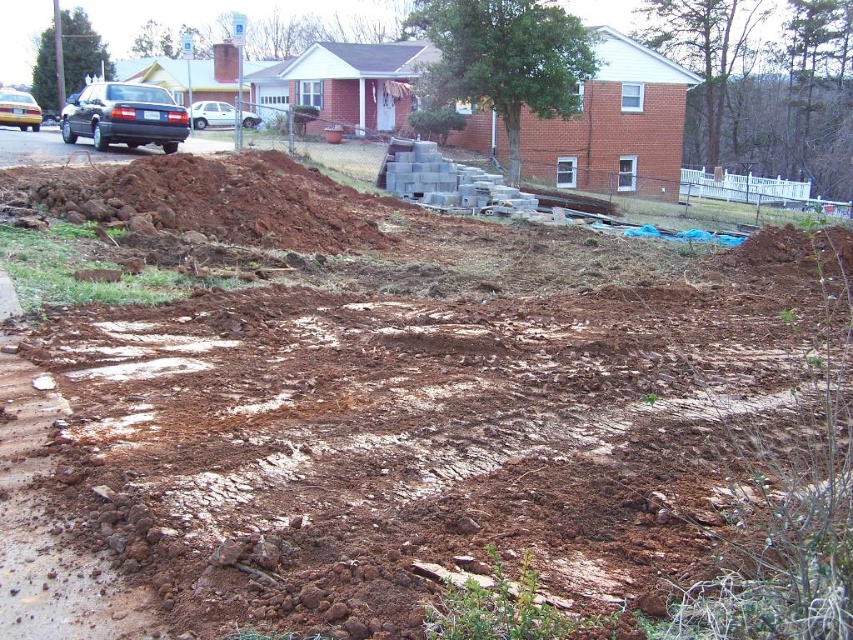
Does matte blue sedan at left appear on the right side of white matte car at upper left?

No, matte blue sedan at left is not to the right of white matte car at upper left.

Between matte blue sedan at left and white matte car at upper left, which one is positioned higher?

white matte car at upper left is higher up.

Between point (73, 141) and point (196, 113), which one is positioned behind?

Positioned behind is point (196, 113).

Identify the location of matte blue sedan at left. Image resolution: width=853 pixels, height=640 pixels. (125, 116).

Is matte blue sedan at left bigger than matte black car at left?

No, matte blue sedan at left is not bigger than matte black car at left.

Can you confirm if matte blue sedan at left is positioned below matte black car at left?

Yes, matte blue sedan at left is below matte black car at left.

Find the location of a particular element. Image resolution: width=853 pixels, height=640 pixels. matte blue sedan at left is located at coordinates (125, 116).

Does brown dirt mound at left appear on the left side of matte black car at left?

Incorrect, brown dirt mound at left is not on the left side of matte black car at left.

Who is positioned more to the left, brown dirt mound at left or matte black car at left?

From the viewer's perspective, matte black car at left appears more on the left side.

Between point (113, 188) and point (33, 116), which one is positioned in front?

Positioned in front is point (113, 188).

Where is `brown dirt mound at left`? brown dirt mound at left is located at coordinates (218, 198).